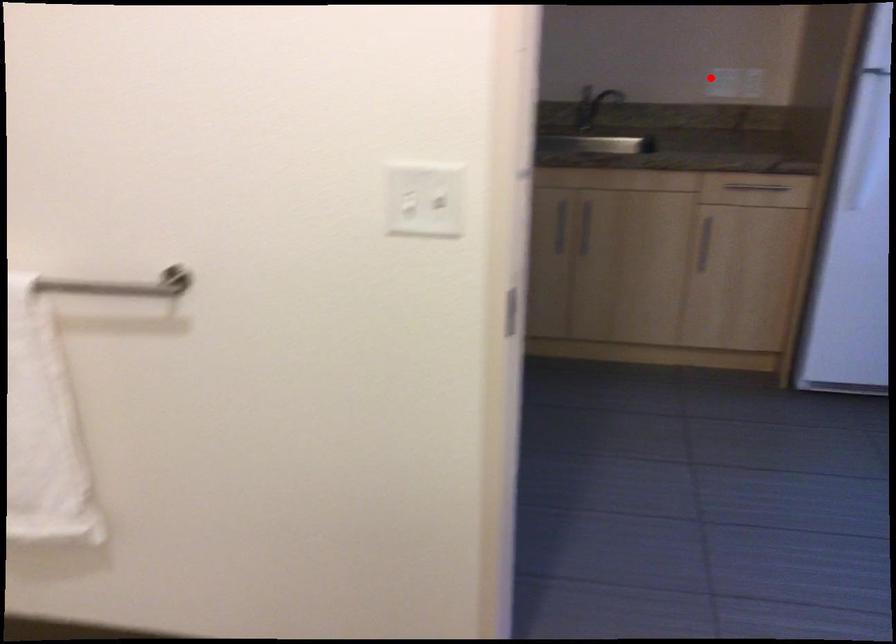
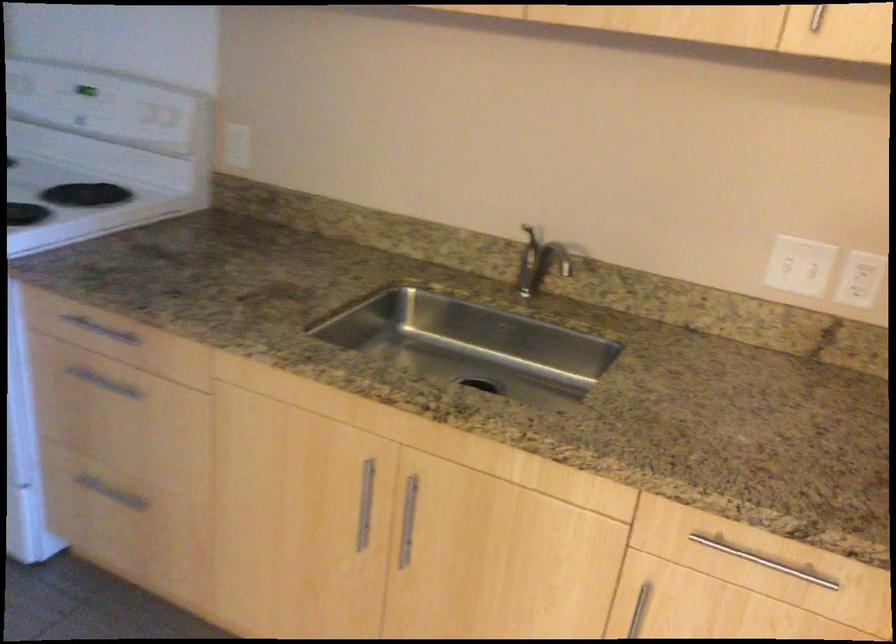
Where in the second image is the point corresponding to the highlighted location from the first image?

(798, 266)